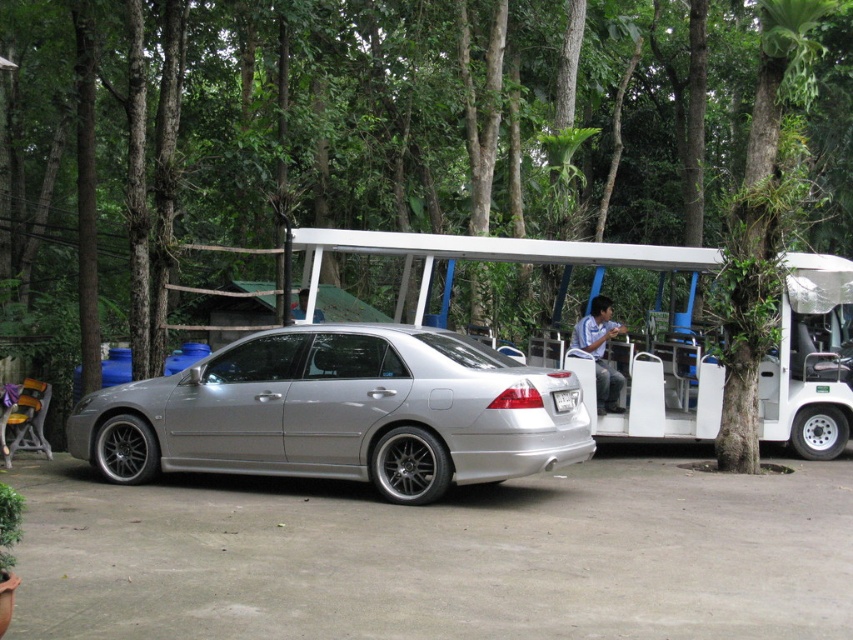
Question: Where is white plastic license plate at rear located in relation to blue fabric shirt at center in the image?

Choices:
 (A) right
 (B) left

Answer: (A)

Question: Among these objects, which one is nearest to the camera?

Choices:
 (A) silver metallic car at center
 (B) green leafy tree at center
 (C) blue fabric shirt at center
 (D) blue striped shirt at center

Answer: (A)

Question: In this image, where is green leafy tree at center located relative to blue striped shirt at center?

Choices:
 (A) right
 (B) left

Answer: (B)

Question: Among these objects, which one is nearest to the camera?

Choices:
 (A) green leafy tree at center
 (B) white plastic license plate at rear

Answer: (B)

Question: Is silver metallic car at center further to camera compared to blue striped shirt at center?

Choices:
 (A) yes
 (B) no

Answer: (B)

Question: Which point is farther to the camera?

Choices:
 (A) silver metallic car at center
 (B) white plastic license plate at rear
 (C) blue fabric shirt at center
 (D) green leafy tree at center

Answer: (C)